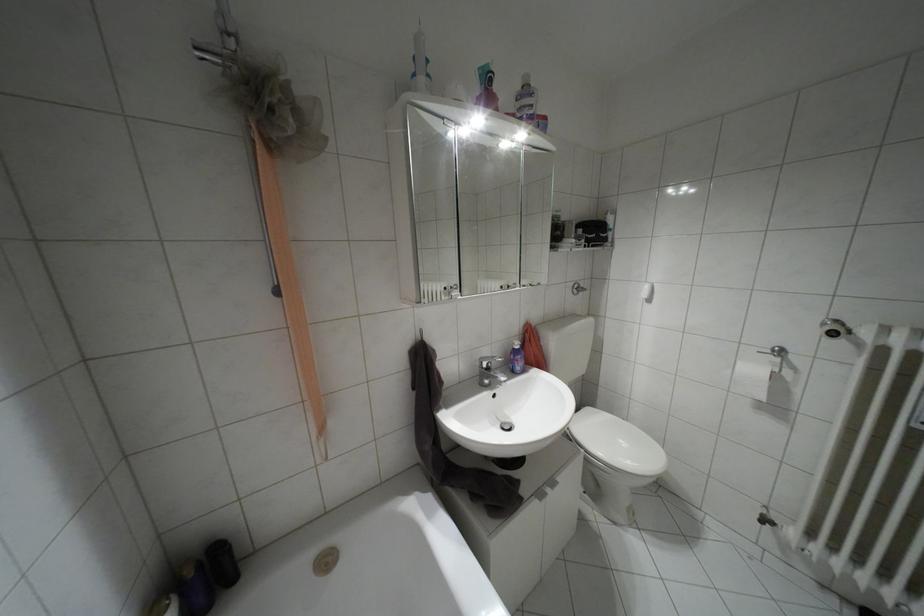
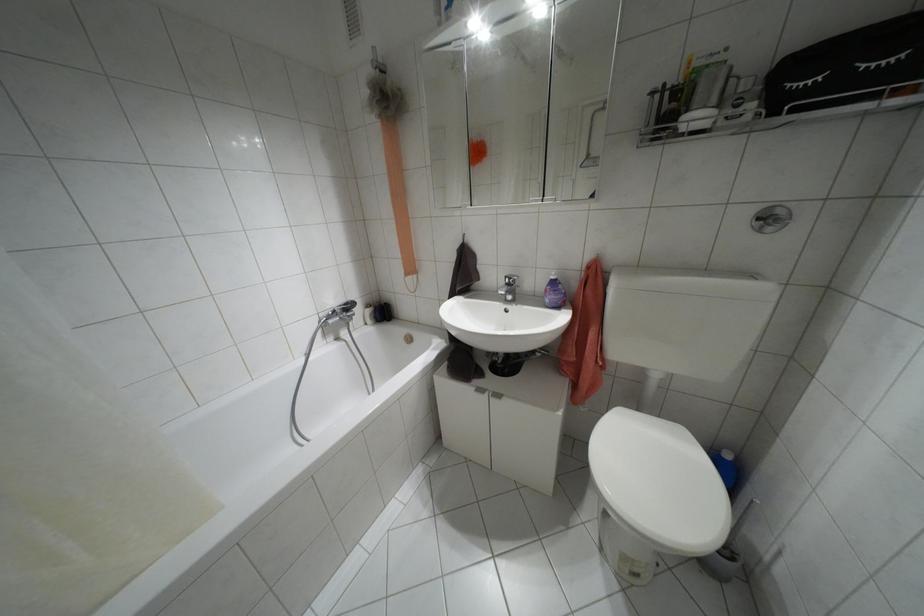
Find the pixel in the second image that matches (574,292) in the first image.

(769, 228)